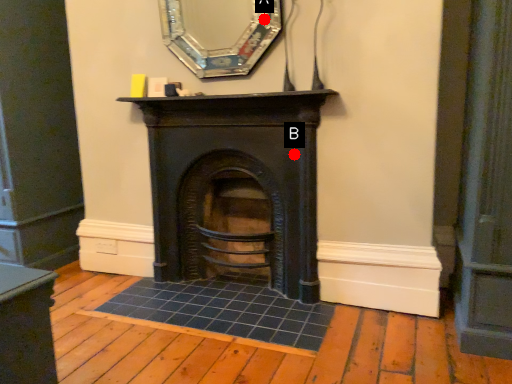
Question: Two points are circled on the image, labeled by A and B beside each circle. Which point is farther to the camera?

Choices:
 (A) A is further
 (B) B is further

Answer: (B)